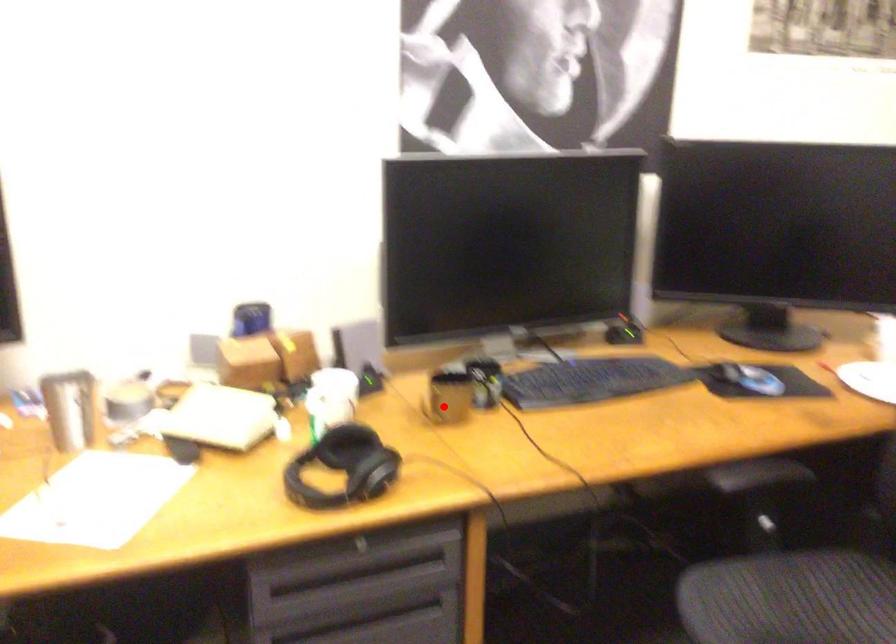
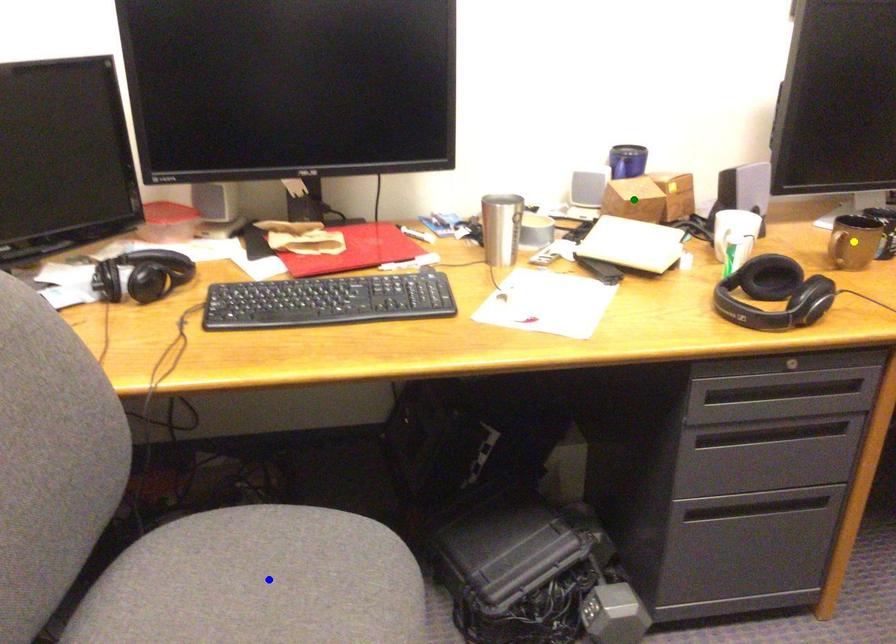
Question: I am providing you with two images of the same scene from different viewpoints. A red point is marked on the first image. You are given multiple points on the second image. Which point in image 2 represents the same 3d spot as the red point in image 1?

Choices:
 (A) blue point
 (B) green point
 (C) yellow point

Answer: (C)